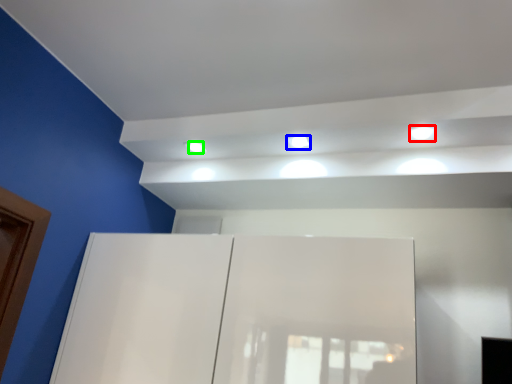
Question: Based on their relative distances, which object is farther from light (highlighted by a red box)? Choose from light (highlighted by a blue box) and dot (highlighted by a green box).

Choices:
 (A) light
 (B) dot

Answer: (B)